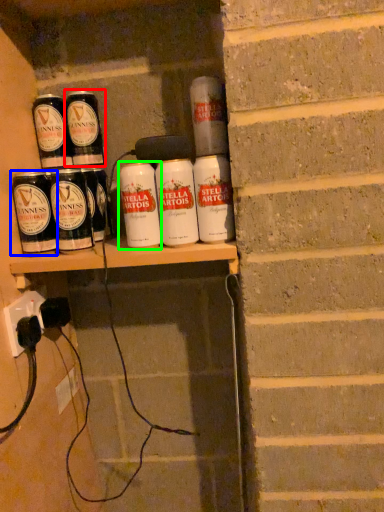
Question: Estimate the real-world distances between objects in this image. Which object is closer to tin can (highlighted by a red box), tin can (highlighted by a blue box) or tin can (highlighted by a green box)?

Choices:
 (A) tin can
 (B) tin can

Answer: (A)